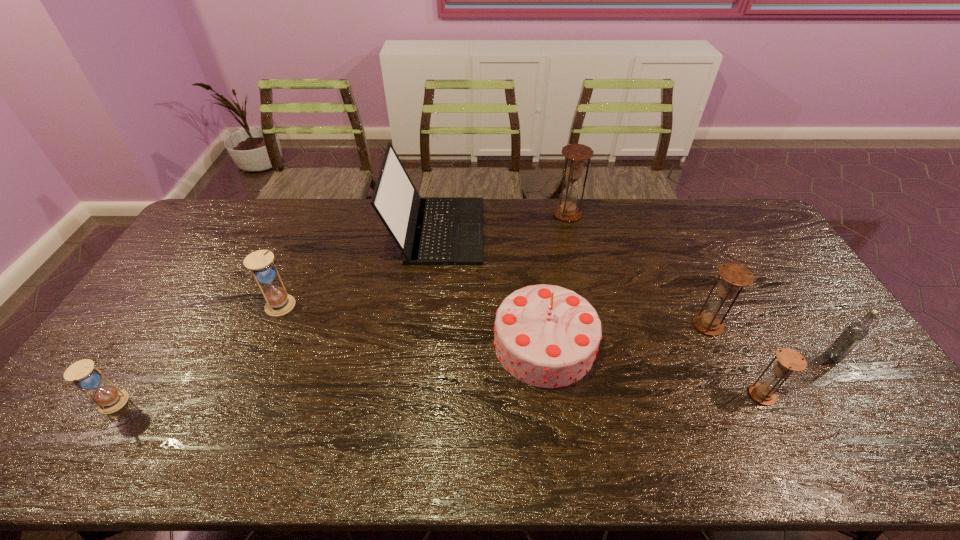
I want to click on the seventh closest object to the birthday cake, so click(82, 374).

Identify which hourglass is located as the fourth nearest to the smallest brown hourglass. Please provide its 2D coordinates. Your answer should be formatted as a tuple, i.e. [(x, y)], where the tuple contains the x and y coordinates of a point satisfying the conditions above.

[(82, 374)]

Find the location of a particular element. The height and width of the screenshot is (540, 960). hourglass that is the third nearest to the leftmost object is located at coordinates click(x=734, y=276).

The image size is (960, 540). In order to click on brown hourglass that stands as the closest to the right white hourglass in this screenshot , I will do `click(576, 154)`.

Identify the location of brown hourglass that is the third closest to the nearer white hourglass. The height and width of the screenshot is (540, 960). (789, 360).

Image resolution: width=960 pixels, height=540 pixels. I want to click on vacant position in the image that satisfies the following two spatial constraints: 1. on the surface of the gray laptop; 2. on the back side of the birthday cake, so click(424, 344).

This screenshot has height=540, width=960. Find the location of `vacant space that satisfies the following two spatial constraints: 1. on the front side of the bigger white hourglass; 2. on the right side of the birthday cake`. vacant space that satisfies the following two spatial constraints: 1. on the front side of the bigger white hourglass; 2. on the right side of the birthday cake is located at coordinates [x=266, y=344].